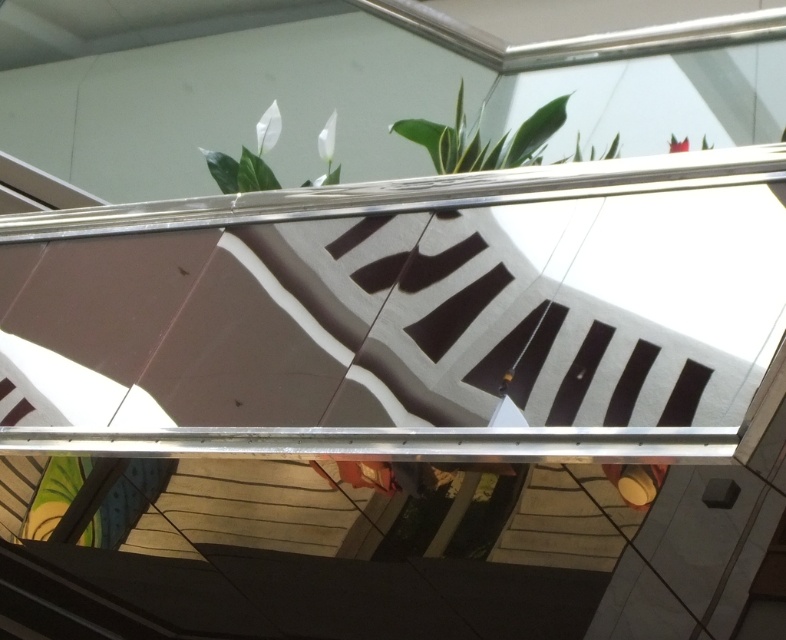
Which is above, green leafy plant at upper center or white matte leaf at upper center?

green leafy plant at upper center is higher up.

Between green leafy plant at upper center and white matte leaf at upper center, which one appears on the left side from the viewer's perspective?

Answer: Positioned to the left is white matte leaf at upper center.

Image resolution: width=786 pixels, height=640 pixels. What do you see at coordinates (485, 141) in the screenshot?
I see `green leafy plant at upper center` at bounding box center [485, 141].

You are a GUI agent. You are given a task and a screenshot of the screen. Output one action in this format:
    pyautogui.click(x=<x>, y=<y>)
    Task: Click on the green leafy plant at upper center
    
    Given the screenshot: What is the action you would take?
    pyautogui.click(x=485, y=141)